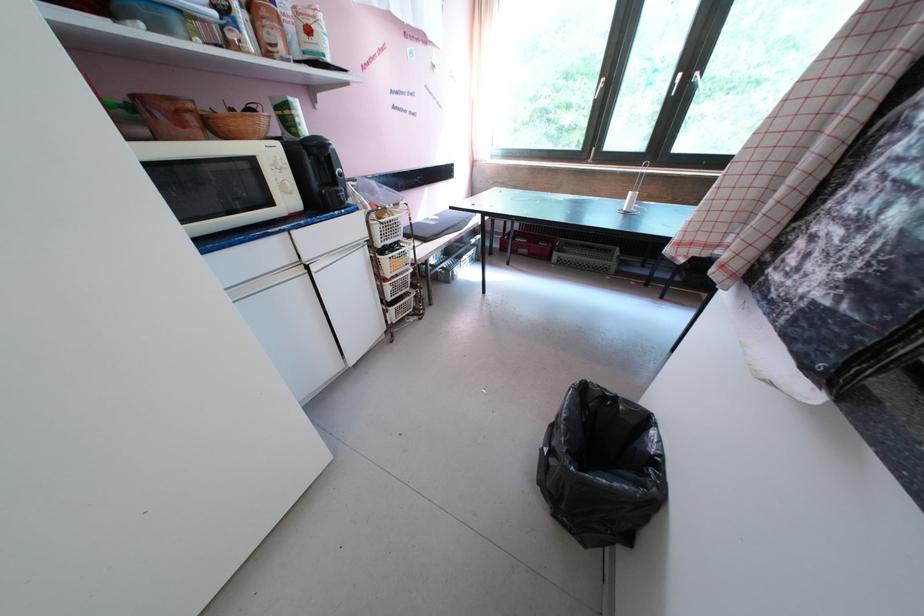
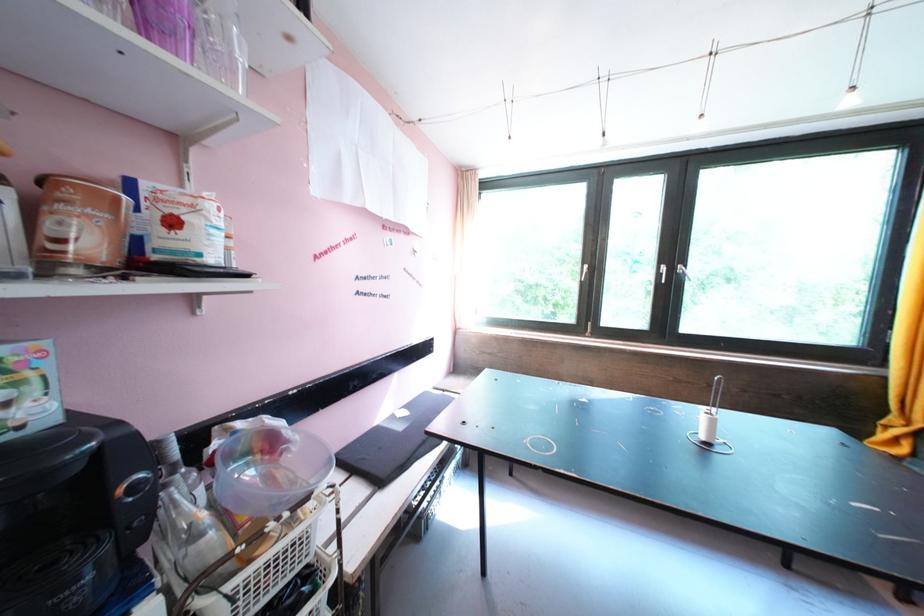
Question: Which direction would the cameraman need to move to produce the second image? Reply with the corresponding letter.

Choices:
 (A) Left
 (B) Right
 (C) Forward
 (D) Backward

Answer: (C)